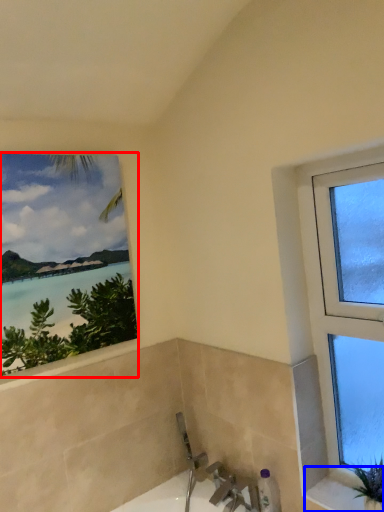
Question: Among these objects, which one is nearest to the camera, window (highlighted by a red box) or window sill (highlighted by a blue box)?

Choices:
 (A) window
 (B) window sill

Answer: (B)